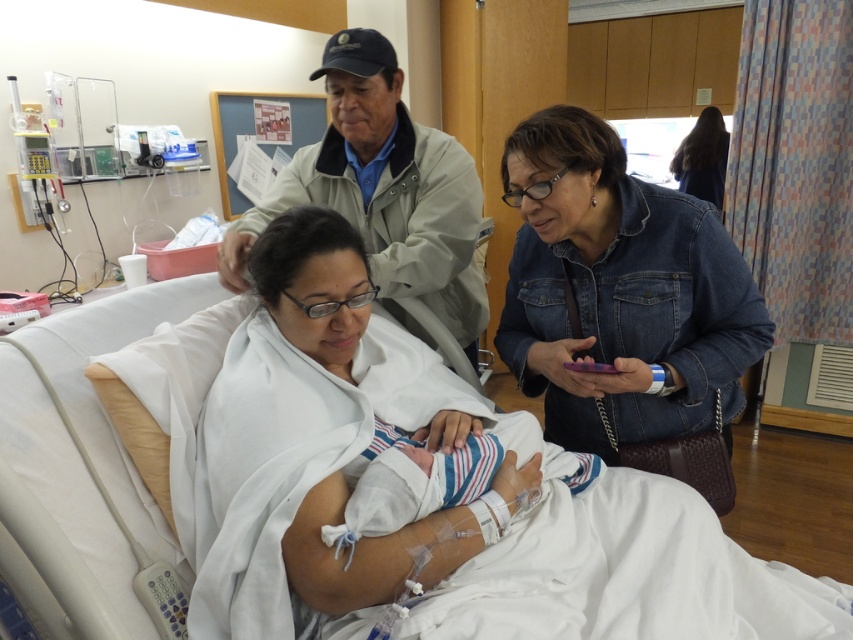
Question: Does white fabric hospital bed at center appear on the right side of striped fabric swaddle at center?

Choices:
 (A) no
 (B) yes

Answer: (B)

Question: Which of these objects is positioned closest to the khaki jacket at upper center?

Choices:
 (A) denim jacket at right
 (B) white fabric hospital bed at center

Answer: (A)

Question: Can you confirm if khaki jacket at upper center is wider than striped fabric swaddle at center?

Choices:
 (A) yes
 (B) no

Answer: (A)

Question: Estimate the real-world distances between objects in this image. Which object is closer to the denim jacket at right?

Choices:
 (A) white fabric hospital bed at center
 (B) dark brown hair at upper right
 (C) khaki jacket at upper center
 (D) striped fabric swaddle at center

Answer: (D)

Question: Is khaki jacket at upper center further to the viewer compared to dark brown hair at upper right?

Choices:
 (A) yes
 (B) no

Answer: (B)

Question: Which of the following is the farthest from the observer?

Choices:
 (A) striped fabric swaddle at center
 (B) khaki jacket at upper center
 (C) white fabric hospital bed at center

Answer: (B)